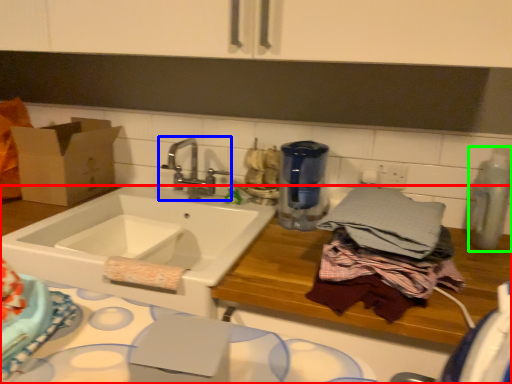
Question: Which is nearer to the counter (highlighted by a red box)? tap (highlighted by a blue box) or appliance (highlighted by a green box).

Choices:
 (A) tap
 (B) appliance

Answer: (B)